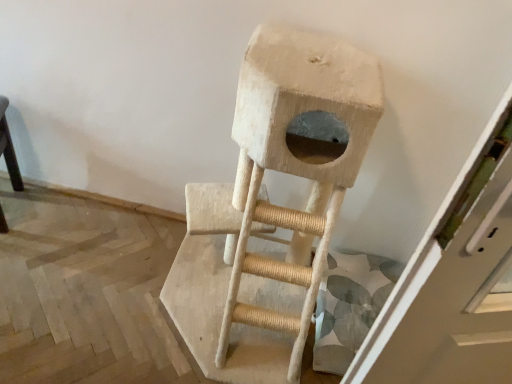
This screenshot has width=512, height=384. Identify the location of free space between smooth black table at left and natural wood cat tree at center. (91, 251).